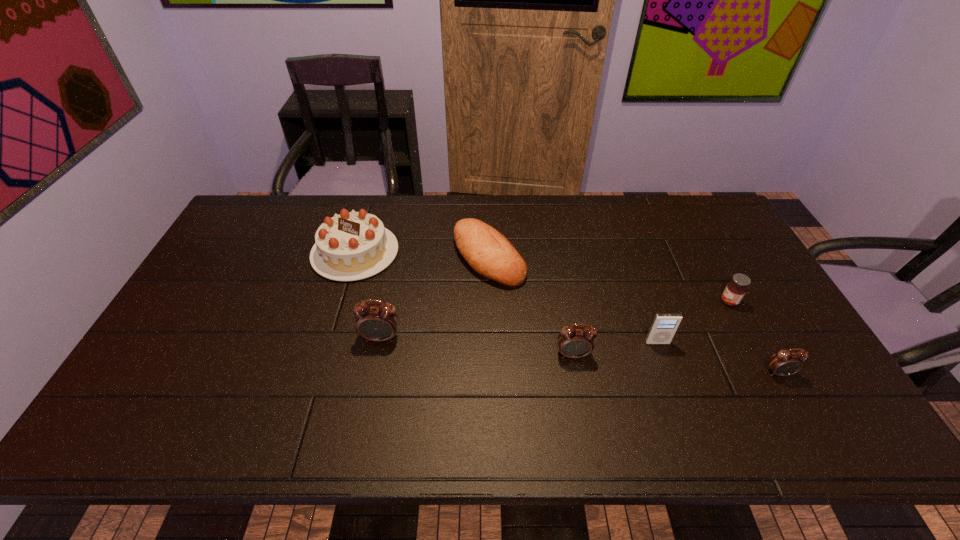
Please point out where to position a new alarm clock on the left to maintain spacing. Please provide its 2D coordinates. Your answer should be formatted as a tuple, i.e. [(x, y)], where the tuple contains the x and y coordinates of a point satisfying the conditions above.

[(201, 321)]